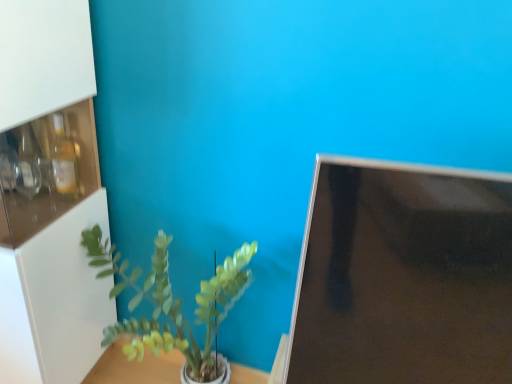
Question: From the image's perspective, relative to black glossy monitor at right, is white glossy cabinet at left above or below?

Choices:
 (A) above
 (B) below

Answer: (A)

Question: In the image, is white glossy cabinet at left on the left side or the right side of black glossy monitor at right?

Choices:
 (A) left
 (B) right

Answer: (A)

Question: Which object is the farthest from the black glossy monitor at right?

Choices:
 (A) green matte plant at center
 (B) white glossy table at center
 (C) white glossy cabinet at left

Answer: (B)

Question: Estimate the real-world distances between objects in this image. Which object is farther from the white glossy table at center?

Choices:
 (A) black glossy monitor at right
 (B) green matte plant at center
 (C) white glossy cabinet at left

Answer: (A)